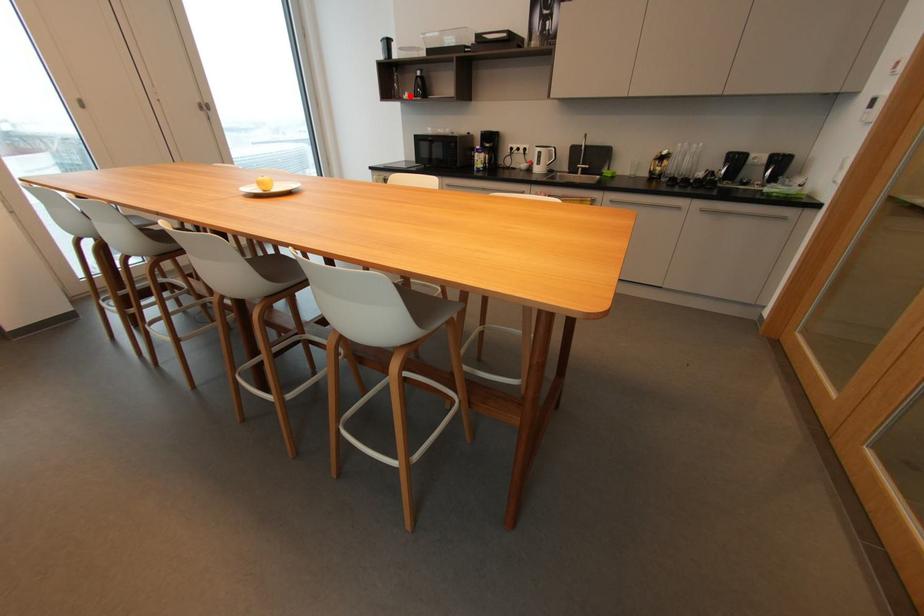
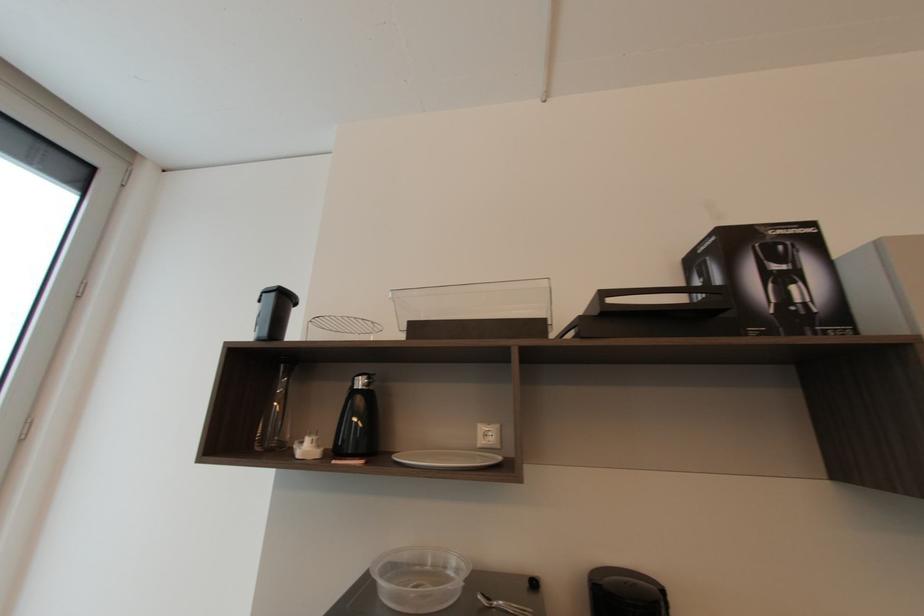
Find the pixel in the second image that matches the highlighted location in the first image.

(310, 447)